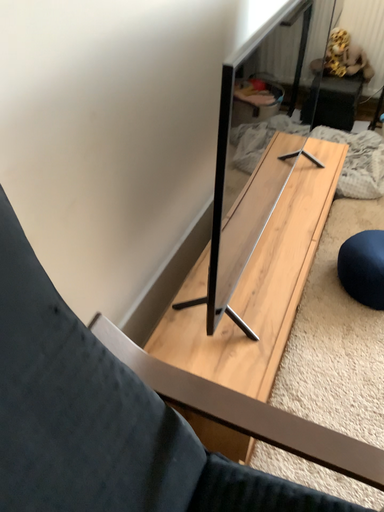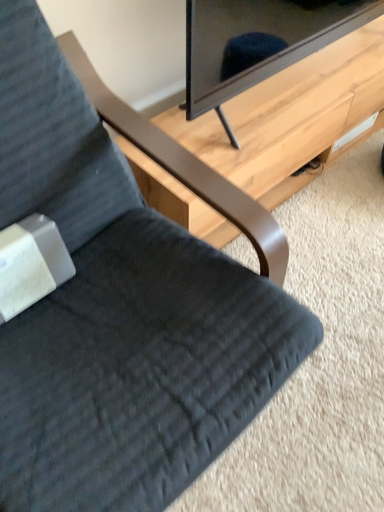
Question: Which way did the camera rotate in the video?

Choices:
 (A) rotated downward
 (B) rotated upward

Answer: (A)